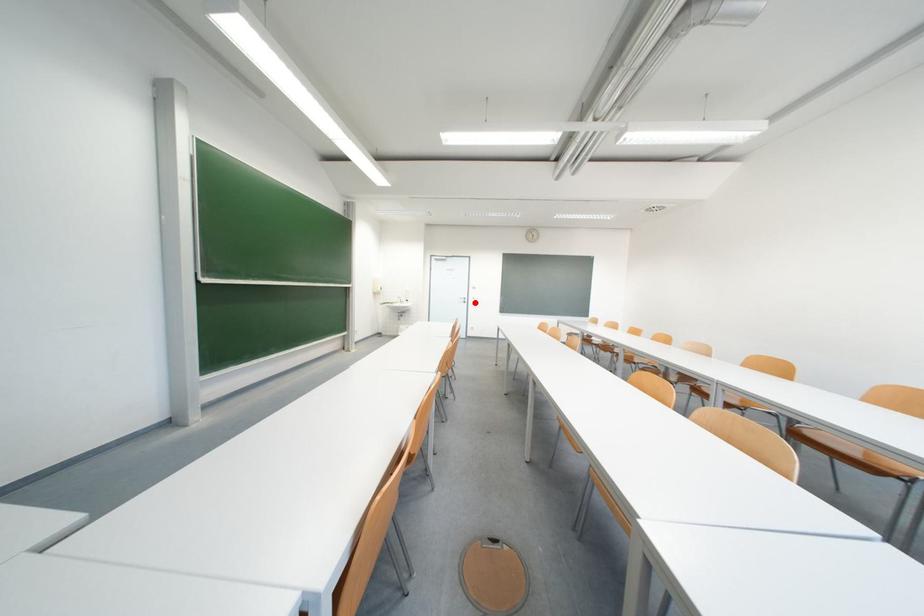
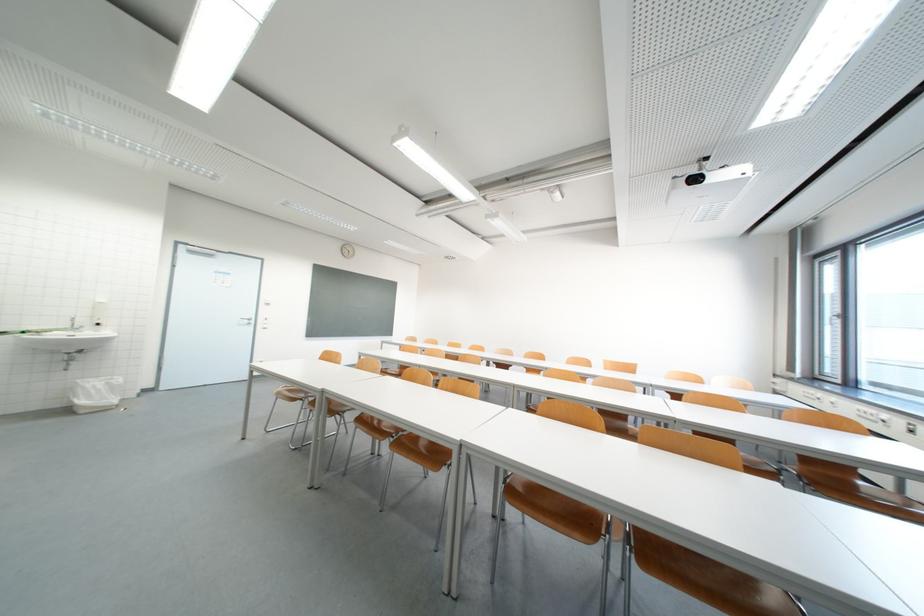
In the second image, find the point that corresponds to the highlighted location in the first image.

(261, 323)